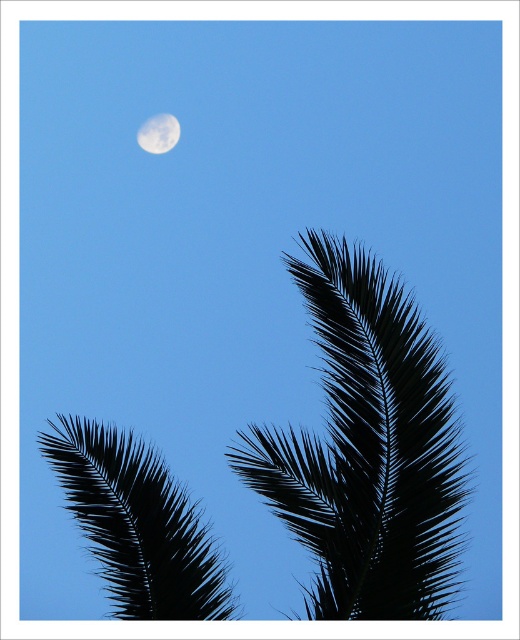
Question: Among these objects, which one is farthest from the camera?

Choices:
 (A) white/smooth moon at upper center
 (B) black spiky palm at center
 (C) black matte palm leaf at lower left

Answer: (A)

Question: Is black matte palm leaf at lower left positioned before white/smooth moon at upper center?

Choices:
 (A) no
 (B) yes

Answer: (B)

Question: Is black spiky palm at center smaller than white/smooth moon at upper center?

Choices:
 (A) no
 (B) yes

Answer: (A)

Question: Is black matte palm leaf at lower left below white/smooth moon at upper center?

Choices:
 (A) yes
 (B) no

Answer: (A)

Question: Among these objects, which one is nearest to the camera?

Choices:
 (A) white/smooth moon at upper center
 (B) black spiky palm at center

Answer: (B)

Question: Which object is farther from the camera taking this photo?

Choices:
 (A) black spiky palm at center
 (B) white/smooth moon at upper center
 (C) black matte palm leaf at lower left

Answer: (B)